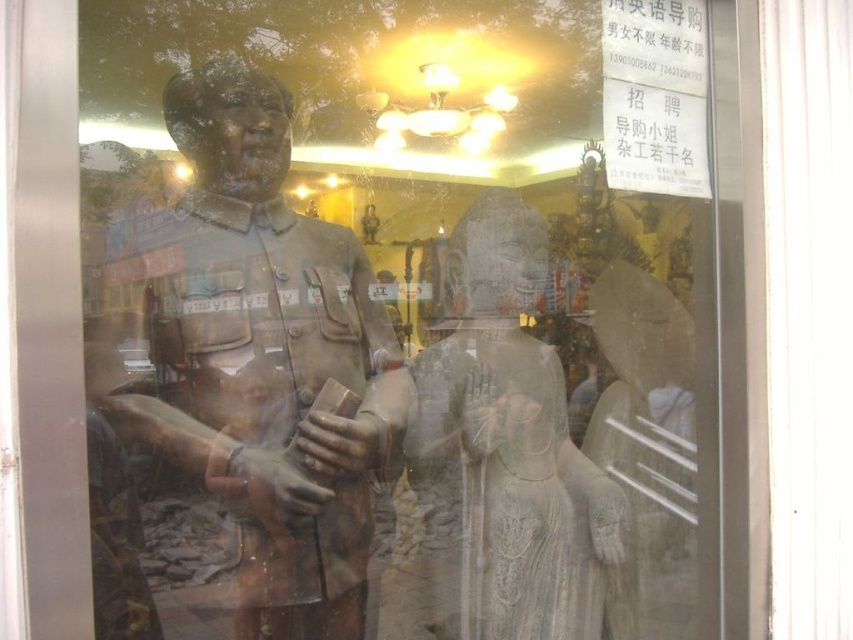
You are an art student observing the statues in the display case. You notice the rusty stone statue at center and the white marble statue at right. Which statue is positioned to the left of the other?

The rusty stone statue at center is positioned to the left of the white marble statue at right.

You are a visitor standing in front of the display case and want to touch both the bronze statue at left and the other statue. Since you can only reach up to 1.5 meters, can you comfortably reach both statues?

The bronze statue at left and the other statue are 1.37 meters apart, so yes, you can comfortably reach both statues since the distance between them is within your 1.5 meters reach.

You are a museum curator who needs to place a new 12 inch wide decorative item between the rusty stone statue at center and the white marble statue at right. Can you fit it there?

The rusty stone statue at center is 10.81 inches from the white marble statue at right. Since the decorative item is 12 inches wide, it cannot fit in the space between them.